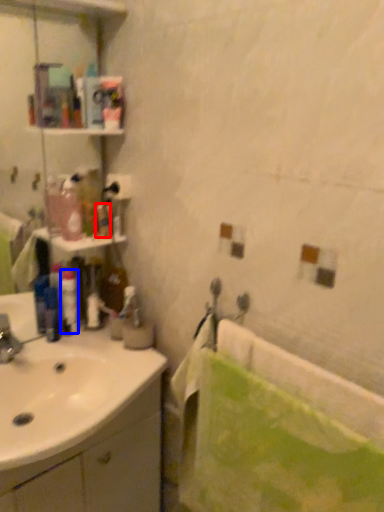
Question: Which of the following is the farthest to the observer, toiletry (highlighted by a red box) or toiletry (highlighted by a blue box)?

Choices:
 (A) toiletry
 (B) toiletry

Answer: (B)